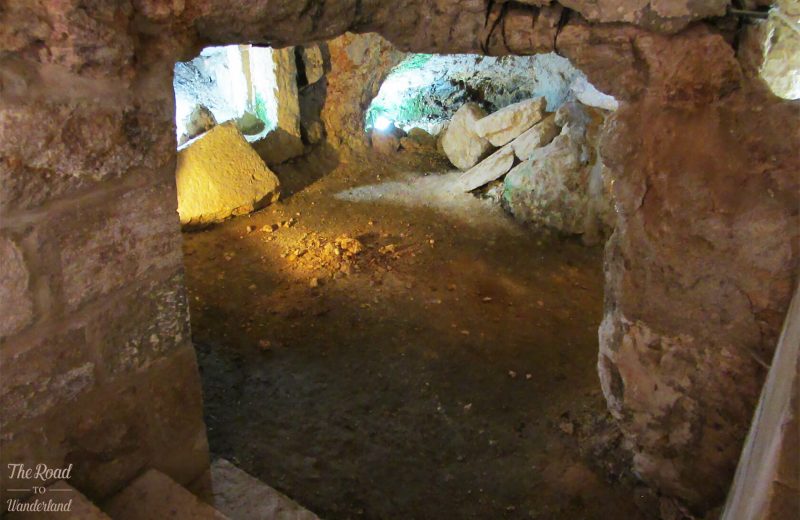
The height and width of the screenshot is (520, 800). In order to click on top of entry way in this screenshot , I will do `click(453, 24)`.